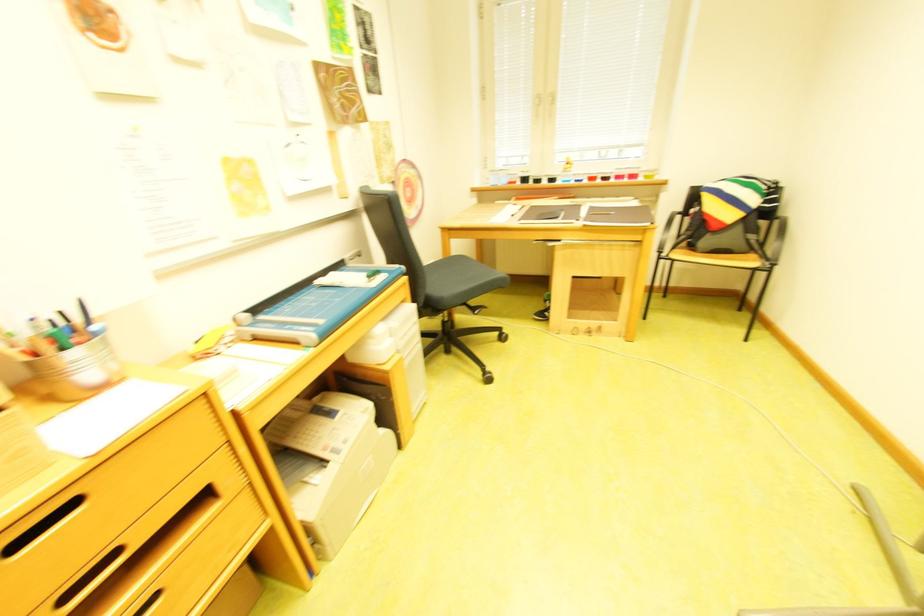
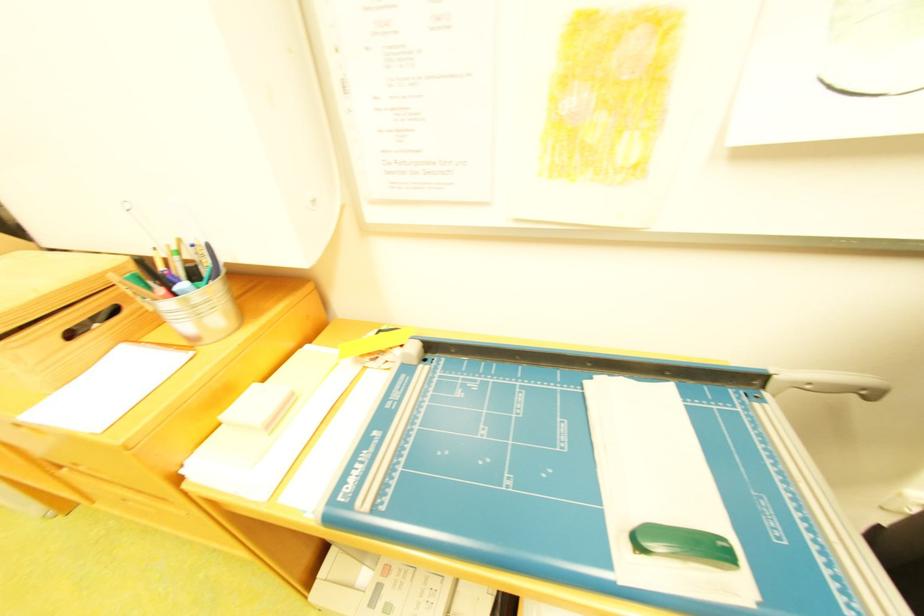
Find the pixel in the second image that matches point 362,257 in the first image.

(821, 385)